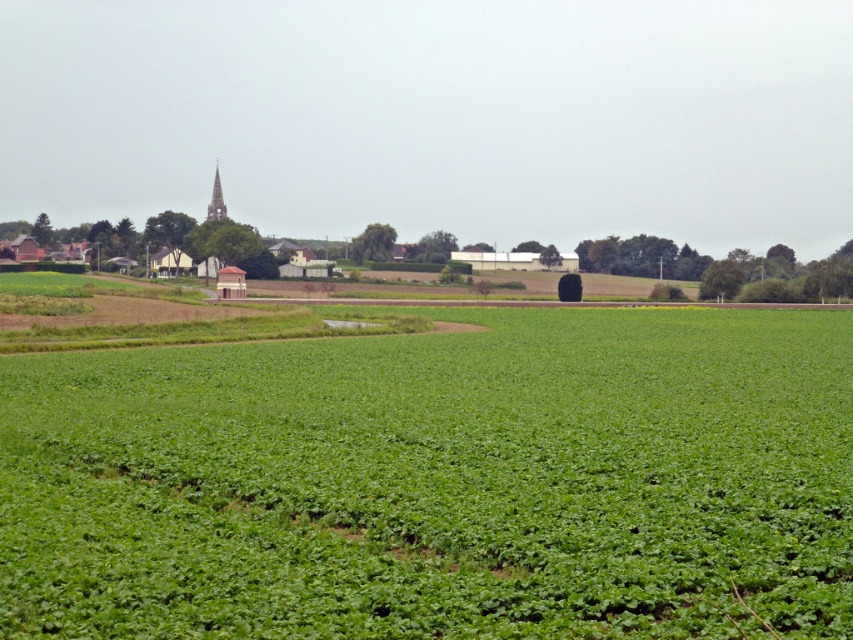
Question: Which point is closer to the camera?

Choices:
 (A) green leafy field at center
 (B) smooth gray spire at upper left

Answer: (A)

Question: Can you confirm if green leafy field at center is positioned to the left of smooth gray spire at upper left?

Choices:
 (A) no
 (B) yes

Answer: (A)

Question: Is green leafy field at center wider than smooth gray spire at upper left?

Choices:
 (A) no
 (B) yes

Answer: (B)

Question: Where is green leafy field at center located in relation to smooth gray spire at upper left in the image?

Choices:
 (A) right
 (B) left

Answer: (A)

Question: Among these objects, which one is nearest to the camera?

Choices:
 (A) green leafy field at center
 (B) smooth gray spire at upper left

Answer: (A)